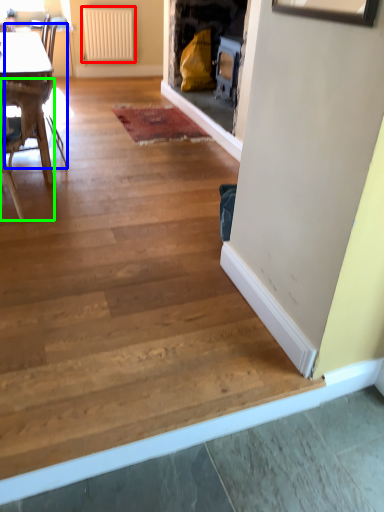
Question: Based on their relative distances, which object is farther from radiator (highlighted by a red box)? Choose from armchair (highlighted by a blue box) and chair (highlighted by a green box).

Choices:
 (A) armchair
 (B) chair

Answer: (B)